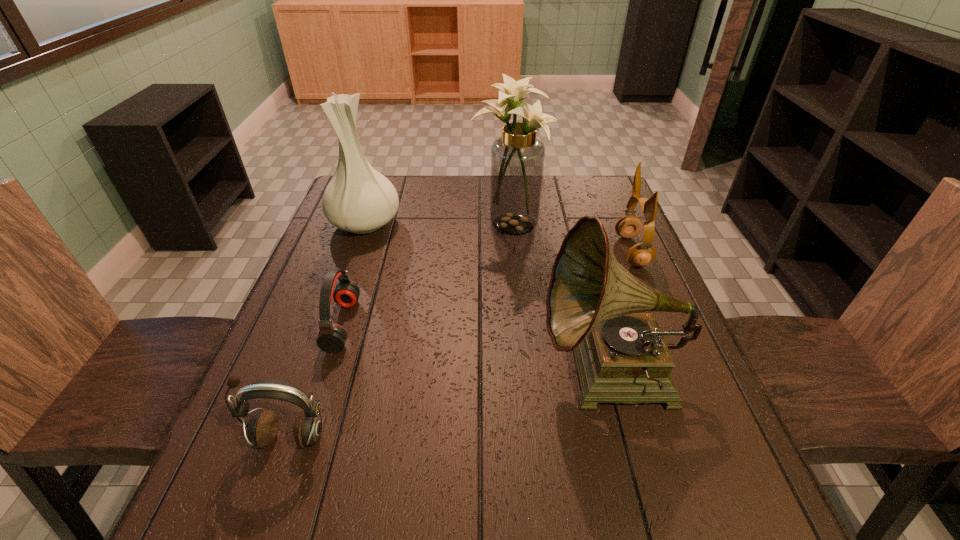
I want to click on blank space that satisfies the following two spatial constraints: 1. from the horn of the record player; 2. on the ear pads of the second shortest object, so click(628, 437).